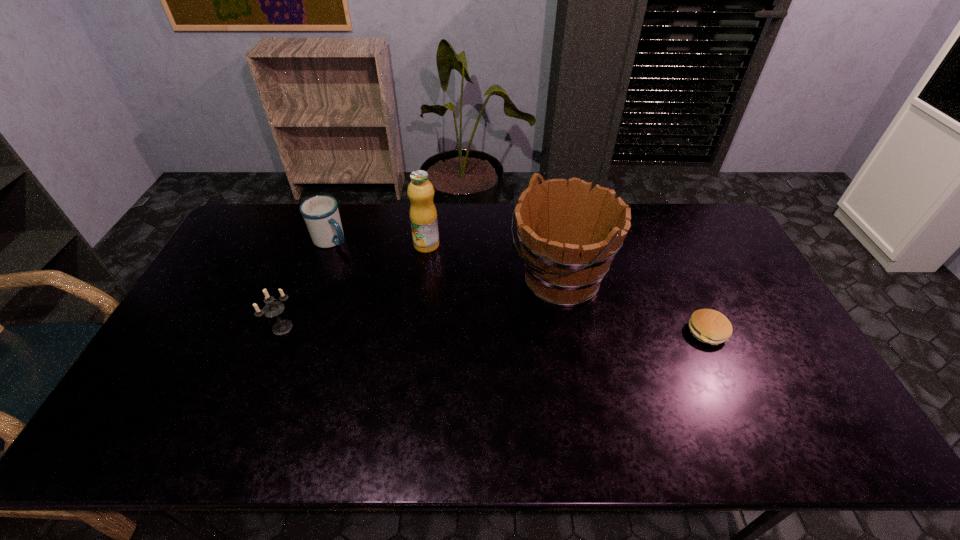
Image resolution: width=960 pixels, height=540 pixels. In order to click on free space located 0.280m on the front label of the fruit juice in this screenshot , I will do `click(432, 316)`.

You are a GUI agent. You are given a task and a screenshot of the screen. Output one action in this format:
    pyautogui.click(x=<x>, y=<y>)
    Task: Click on the free space located with the handle on the second object from right to left
    Image resolution: width=960 pixels, height=540 pixels.
    Given the screenshot: What is the action you would take?
    pyautogui.click(x=463, y=332)

I want to click on free location located with the handle on the second object from right to left, so click(x=438, y=344).

The image size is (960, 540). What are the coordinates of `vacant space situated 0.150m with the handle on the second object from right to left` in the screenshot? It's located at (477, 324).

This screenshot has height=540, width=960. I want to click on free space located 0.150m on the handle side of the mug, so click(373, 268).

At what (x,y) coordinates should I click in order to perform the action: click on free region located 0.210m on the handle side of the mug. Please return your answer as a coordinate pair (x, y). Image resolution: width=960 pixels, height=540 pixels. Looking at the image, I should click on pyautogui.click(x=386, y=276).

Locate an element on the screen. This screenshot has width=960, height=540. vacant space situated on the handle side of the mug is located at coordinates (384, 275).

You are a GUI agent. You are given a task and a screenshot of the screen. Output one action in this format:
    pyautogui.click(x=<x>, y=<y>)
    Task: Click on the fruit juice that is at the far edge
    The image size is (960, 540).
    Given the screenshot: What is the action you would take?
    pyautogui.click(x=423, y=216)

You are a GUI agent. You are given a task and a screenshot of the screen. Output one action in this format:
    pyautogui.click(x=<x>, y=<y>)
    Task: Click on the mug located at the far edge
    The width and height of the screenshot is (960, 540).
    Given the screenshot: What is the action you would take?
    pyautogui.click(x=321, y=214)

Image resolution: width=960 pixels, height=540 pixels. I want to click on free space at the far edge of the desktop, so click(x=513, y=211).